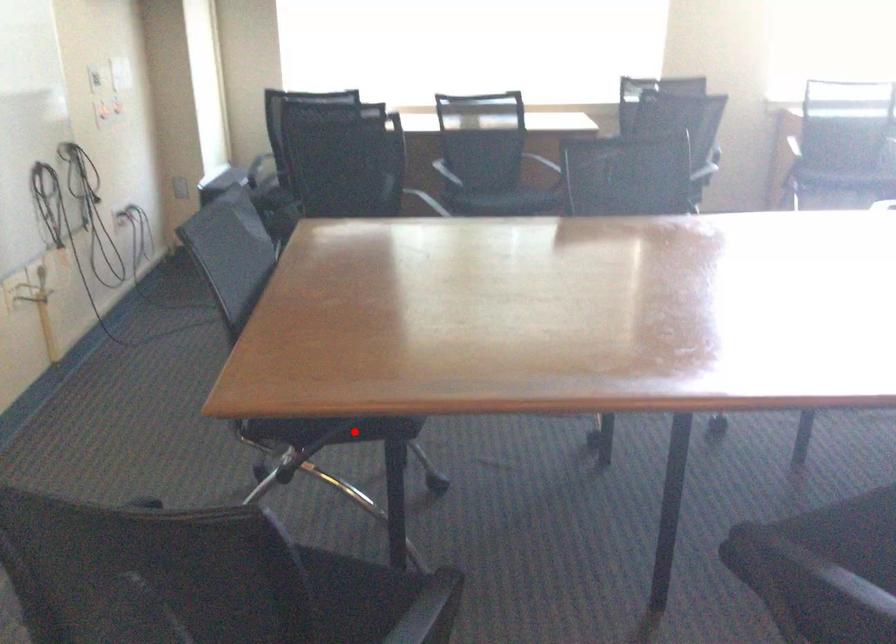
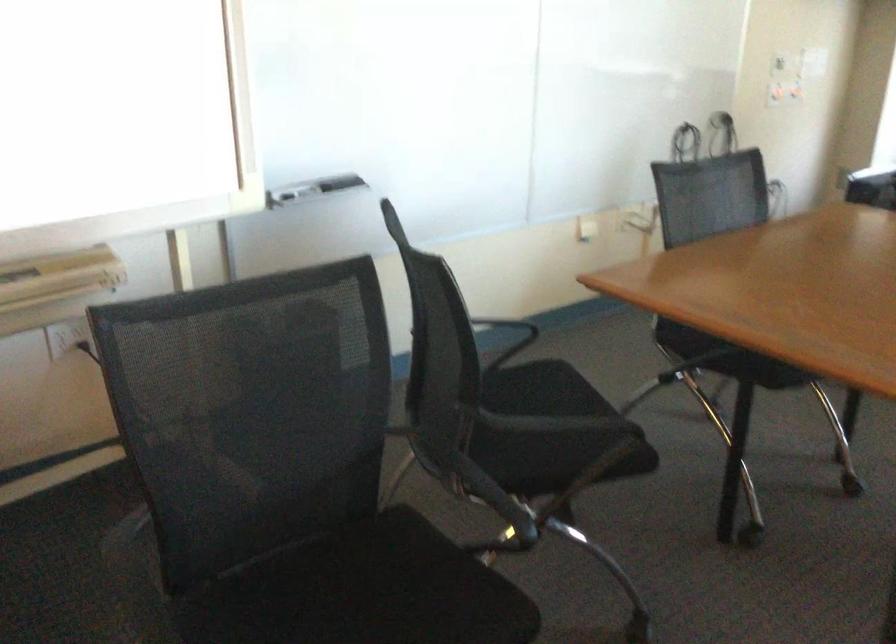
Question: A red point is marked in image1. In image2, is the corresponding 3D point closer to the camera or farther? Reply with the corresponding letter.

Choices:
 (A) The corresponding 3D point is closer.
 (B) The corresponding 3D point is farther.

Answer: (B)